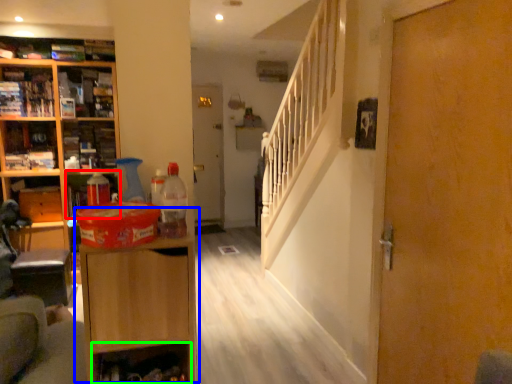
Question: Estimate the real-world distances between objects in this image. Which object is farther from cabinet (highlighted by a red box), cabinetry (highlighted by a blue box) or shelf (highlighted by a green box)?

Choices:
 (A) cabinetry
 (B) shelf

Answer: (A)